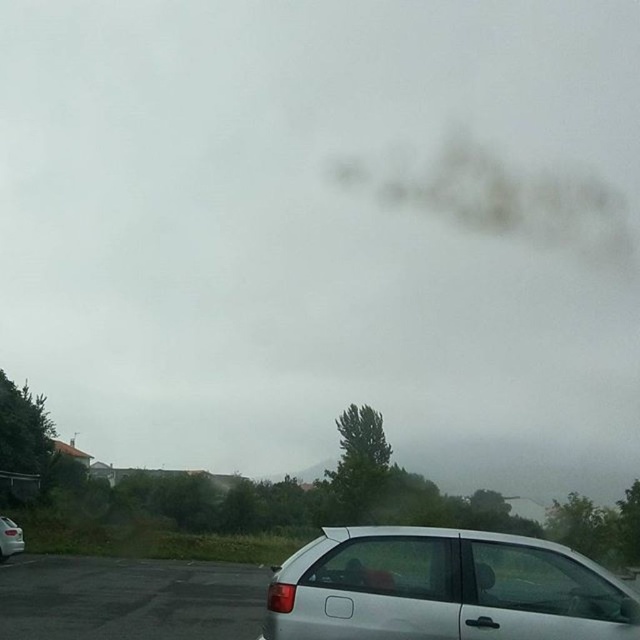
Describe the element at coordinates (128, 598) in the screenshot. I see `black asphalt parking lot at lower left` at that location.

Does black asphalt parking lot at lower left lie in front of silver metallic car at lower left?

Yes.

Between point (28, 620) and point (1, 536), which one is positioned behind?

Positioned behind is point (1, 536).

Identify the location of black asphalt parking lot at lower left. This screenshot has height=640, width=640. (128, 598).

Who is shorter, silver metallic hatchback at lower center or black asphalt parking lot at lower left?

Standing shorter between the two is silver metallic hatchback at lower center.

Which is more to the left, silver metallic hatchback at lower center or black asphalt parking lot at lower left?

From the viewer's perspective, black asphalt parking lot at lower left appears more on the left side.

Between point (353, 557) and point (120, 618), which one is positioned in front?

Positioned in front is point (353, 557).

At what (x,y) coordinates should I click in order to perform the action: click on silver metallic hatchback at lower center. Please return your answer as a coordinate pair (x, y). Looking at the image, I should click on pyautogui.click(x=444, y=588).

Does silver metallic hatchback at lower center have a lesser width compared to silver metallic car at lower left?

In fact, silver metallic hatchback at lower center might be wider than silver metallic car at lower left.

How far apart are silver metallic hatchback at lower center and silver metallic car at lower left?

They are 66.17 feet apart.

Where is `silver metallic hatchback at lower center`? The width and height of the screenshot is (640, 640). silver metallic hatchback at lower center is located at coordinates (444, 588).

The width and height of the screenshot is (640, 640). Find the location of `silver metallic hatchback at lower center`. silver metallic hatchback at lower center is located at coordinates (444, 588).